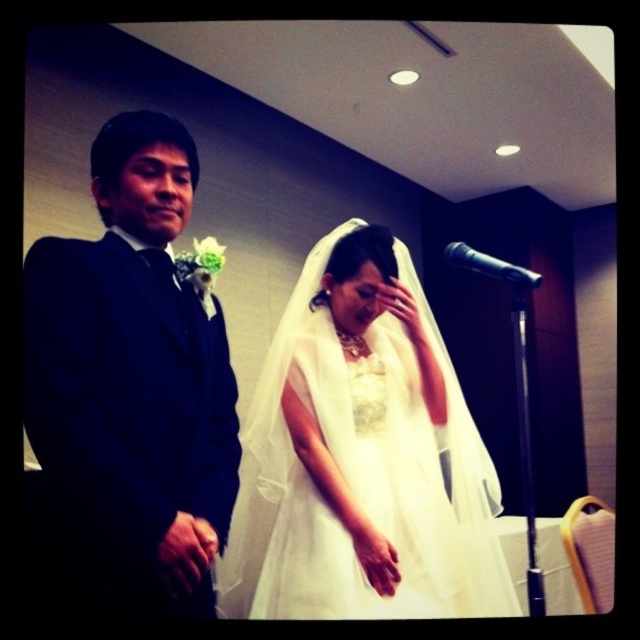
Question: Which object is closer to the camera taking this photo?

Choices:
 (A) black metallic microphone at right
 (B) white sheer dress at center
 (C) white satin dress at center
 (D) matte black suit at left

Answer: (D)

Question: Is white sheer dress at center to the left of black metallic microphone at right from the viewer's perspective?

Choices:
 (A) no
 (B) yes

Answer: (B)

Question: Which of the following is the farthest from the observer?

Choices:
 (A) (244, 588)
 (B) (132, 403)
 (C) (524, 289)

Answer: (A)

Question: Is white satin dress at center positioned before matte black suit at left?

Choices:
 (A) yes
 (B) no

Answer: (B)

Question: Can you confirm if white satin dress at center is positioned below matte black suit at left?

Choices:
 (A) no
 (B) yes

Answer: (B)

Question: Based on their relative distances, which object is nearer to the black metallic microphone at right?

Choices:
 (A) white sheer dress at center
 (B) matte black suit at left

Answer: (A)